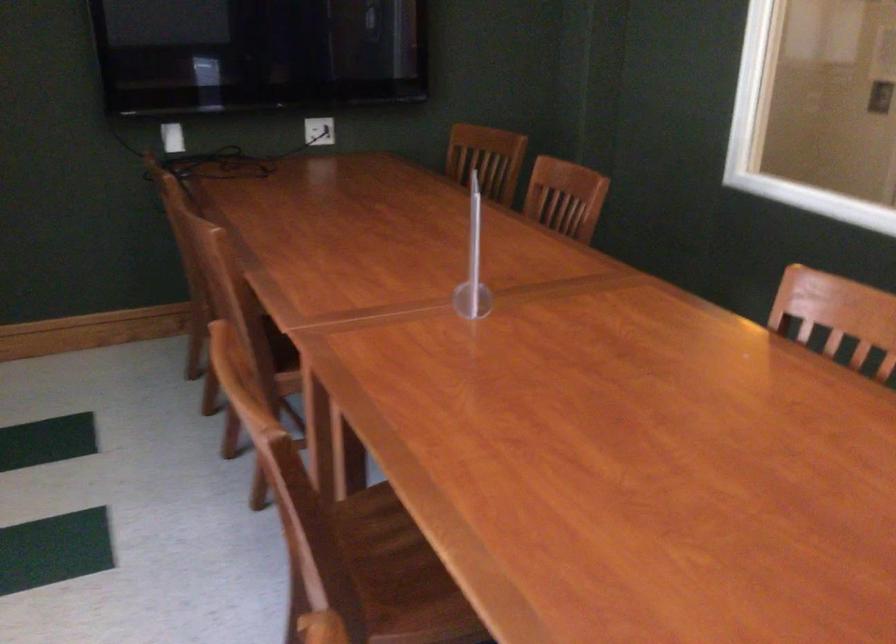
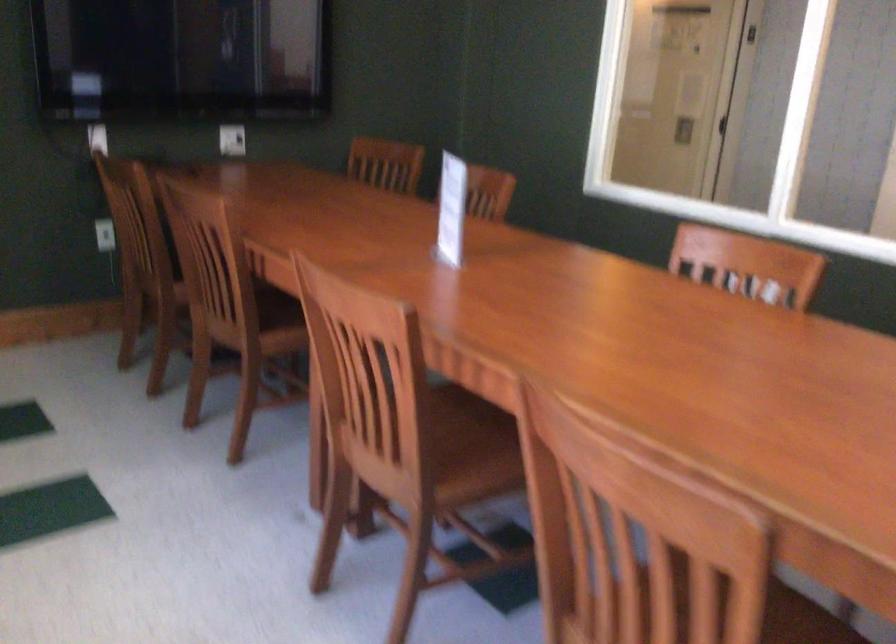
Where in the second image is the point corresponding to point (247, 339) from the first image?

(239, 303)